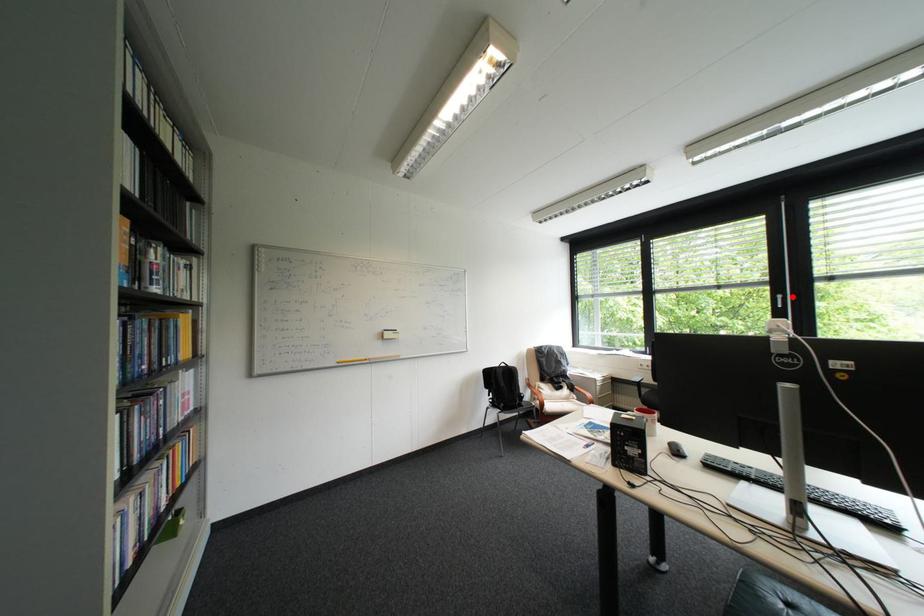
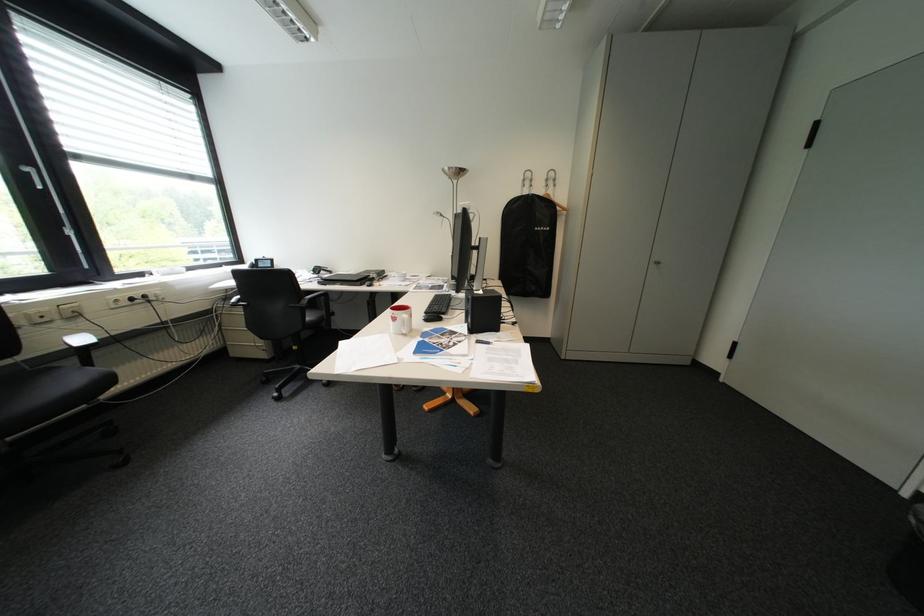
Question: A red point is marked in image1. In image2, is the corresponding 3D point closer to the camera or farther? Reply with the corresponding letter.

Choices:
 (A) The corresponding 3D point is closer.
 (B) The corresponding 3D point is farther.

Answer: (B)